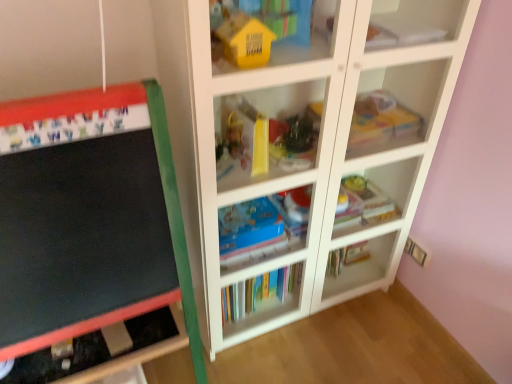
Question: Can we say shiny plastic toy at center, the 2th toy from the front, lies outside white paper at upper right, which is the 3th book in bottom-to-top order?

Choices:
 (A) yes
 (B) no

Answer: (A)

Question: From the image's perspective, is shiny plastic toy at center, the second toy in the left-to-right sequence, located above white paper at upper right, which is the 3th book in bottom-to-top order?

Choices:
 (A) no
 (B) yes

Answer: (A)

Question: Does shiny plastic toy at center, the 2th toy from the front, contain white paper at upper right, which is the 3th book in bottom-to-top order?

Choices:
 (A) no
 (B) yes

Answer: (A)

Question: Is shiny plastic toy at center, which is the 2th toy in right-to-left order, facing away from white paper at upper right, which ranks as the 1th book in top-to-bottom order?

Choices:
 (A) no
 (B) yes

Answer: (A)

Question: Can you confirm if shiny plastic toy at center, the 2th toy from the front, is wider than white paper at upper right, which is the 3th book in bottom-to-top order?

Choices:
 (A) no
 (B) yes

Answer: (B)

Question: From a real-world perspective, is shiny plastic toy at center, which is the 2th toy in right-to-left order, on top of white paper at upper right, which ranks as the 1th book in top-to-bottom order?

Choices:
 (A) yes
 (B) no

Answer: (B)

Question: Is white paper at upper right, which is the 3th book in bottom-to-top order, closer to the viewer compared to blue cardboard book at center, placed as the 2th shelf when sorted from top to bottom?

Choices:
 (A) no
 (B) yes

Answer: (B)

Question: Does white paper at upper right, which ranks as the 1th book in top-to-bottom order, have a lesser height compared to blue cardboard book at center, placed as the 2th shelf when sorted from top to bottom?

Choices:
 (A) yes
 (B) no

Answer: (A)

Question: Does white paper at upper right, which is the 3th book in bottom-to-top order, have a smaller size compared to blue cardboard book at center, the 1th shelf in the bottom-to-top sequence?

Choices:
 (A) yes
 (B) no

Answer: (A)

Question: From the image's perspective, would you say white paper at upper right, which is the 3th book in bottom-to-top order, is positioned over blue cardboard book at center, the 1th shelf in the bottom-to-top sequence?

Choices:
 (A) yes
 (B) no

Answer: (A)

Question: Could you tell me if white paper at upper right, which is the 3th book in bottom-to-top order, is turned towards blue cardboard book at center, placed as the 2th shelf when sorted from top to bottom?

Choices:
 (A) no
 (B) yes

Answer: (A)

Question: Does white paper at upper right, which ranks as the 1th book in top-to-bottom order, appear on the right side of blue cardboard book at center, the 1th shelf in the bottom-to-top sequence?

Choices:
 (A) no
 (B) yes

Answer: (B)

Question: From a real-world perspective, is white paper at upper right, which ranks as the 1th book in top-to-bottom order, located beneath white glossy bookshelf at center, the 2th shelf ordered from the bottom?

Choices:
 (A) no
 (B) yes

Answer: (A)